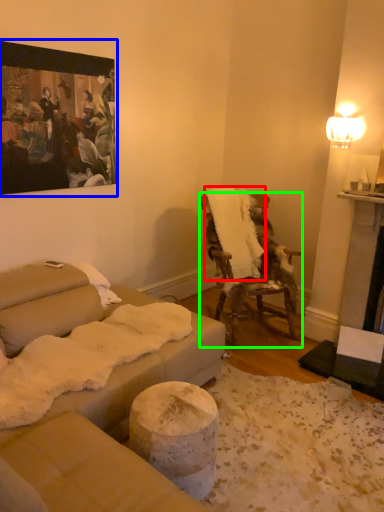
Question: Which is farther away from blanket (highlighted by a red box)? picture frame (highlighted by a blue box) or chair (highlighted by a green box)?

Choices:
 (A) picture frame
 (B) chair

Answer: (A)